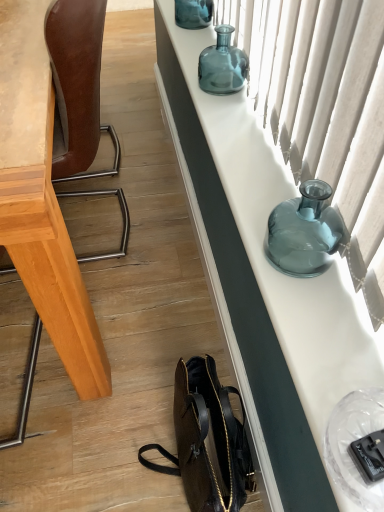
At what (x,y) coordinates should I click in order to perform the action: click on free space between translucent glass vase at upper right, the 3th bottle viewed from the top, and translucent fabric curtain at upper right. Please return your answer as a coordinate pair (x, y). The height and width of the screenshot is (512, 384). Looking at the image, I should click on (271, 178).